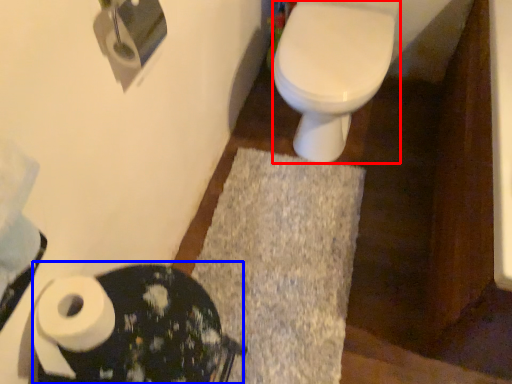
Question: Among these objects, which one is farthest to the camera, bidet (highlighted by a red box) or porcelain (highlighted by a blue box)?

Choices:
 (A) bidet
 (B) porcelain

Answer: (A)